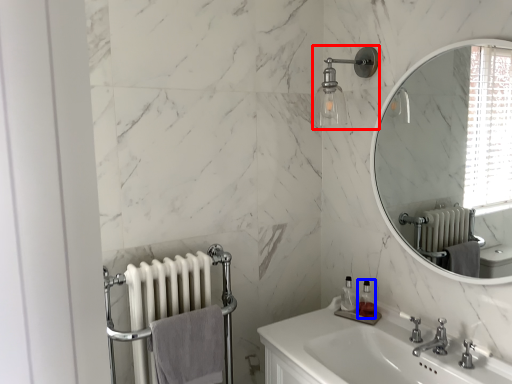
Question: Which point is closer to the camera, shower (highlighted by a red box) or soap dispenser (highlighted by a blue box)?

Choices:
 (A) shower
 (B) soap dispenser

Answer: (A)